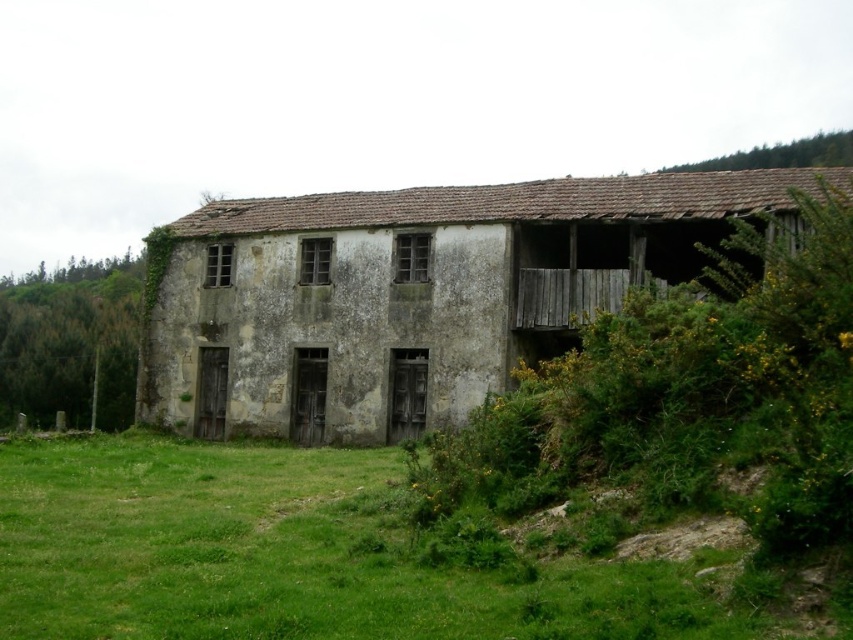
Can you confirm if weathered concrete hut at center is thinner than green grass at lower left?

In fact, weathered concrete hut at center might be wider than green grass at lower left.

Who is more distant from viewer, (323, 400) or (73, 589)?

The point (323, 400) is behind.

Find the location of `weathered concrete hut at center`. weathered concrete hut at center is located at coordinates (410, 292).